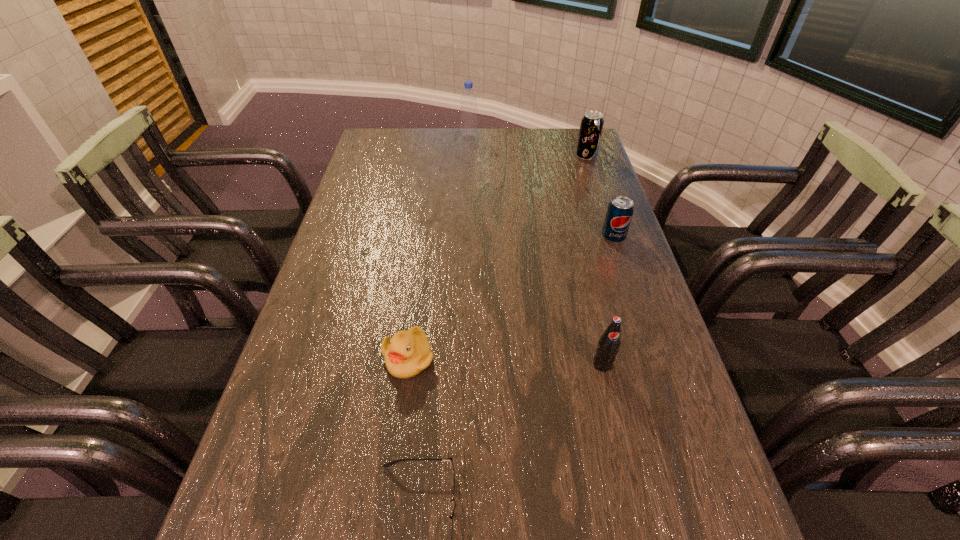
Where is `vacant area situated 0.230m on the front label of the leftmost soda can`? This screenshot has height=540, width=960. vacant area situated 0.230m on the front label of the leftmost soda can is located at coordinates (631, 487).

At what (x,y) coordinates should I click in order to perform the action: click on vacant region located on the front of the fourth nearest object. Please return your answer as a coordinate pair (x, y). This screenshot has height=540, width=960. Looking at the image, I should click on (653, 357).

Identify the location of vacant space located 0.050m on the front-facing side of the fifth tallest object. (402, 402).

The image size is (960, 540). In order to click on bottle that is at the far edge in this screenshot , I will do `click(469, 130)`.

Where is `soda can located at the far edge`? soda can located at the far edge is located at coordinates (591, 126).

I want to click on object positioned at the far right corner, so click(x=591, y=126).

Identify the location of free space at the far edge. Image resolution: width=960 pixels, height=540 pixels. (482, 144).

Identify the location of vacant position at the left edge of the desktop. (312, 326).

Locate an element on the screen. This screenshot has height=540, width=960. free space at the right edge of the desktop is located at coordinates (599, 204).

The width and height of the screenshot is (960, 540). What are the coordinates of `vacant space at the far left corner of the desktop` in the screenshot? It's located at (405, 144).